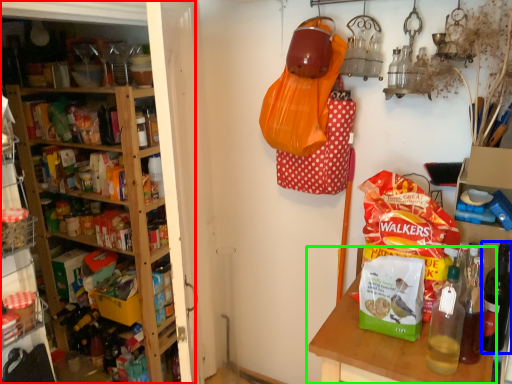
Question: Based on their relative distances, which object is nearer to shelf (highlighted by a red box)? Choose from bottle (highlighted by a blue box) and table (highlighted by a green box).

Choices:
 (A) bottle
 (B) table

Answer: (B)